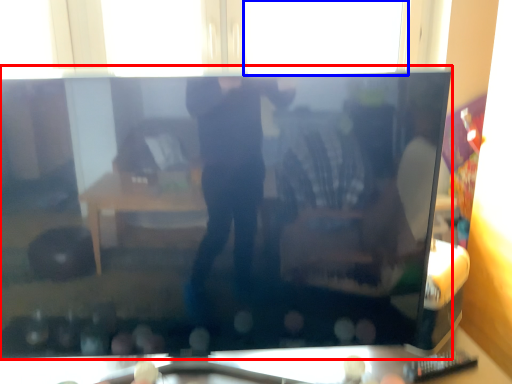
Question: Which object is further to the camera taking this photo, television (highlighted by a red box) or window (highlighted by a blue box)?

Choices:
 (A) television
 (B) window

Answer: (B)